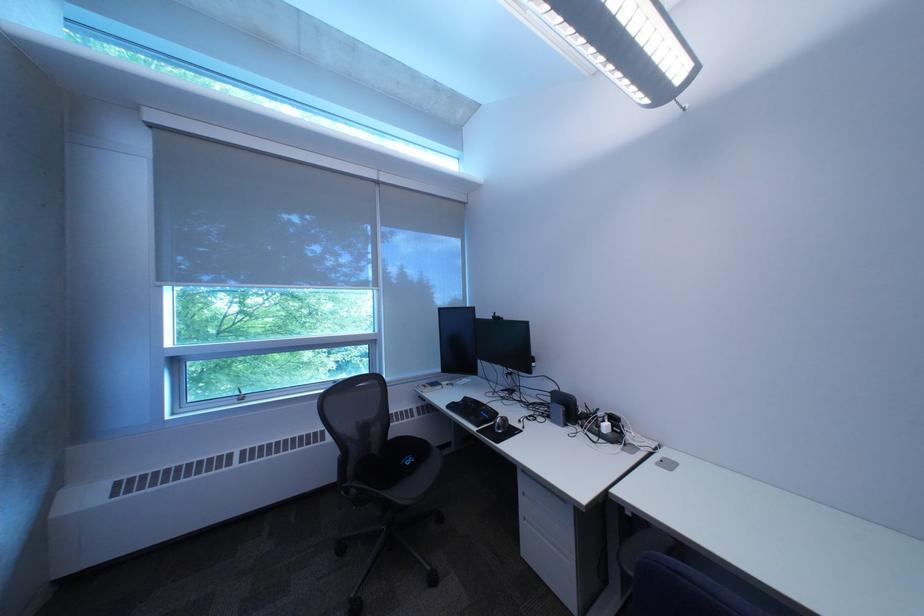
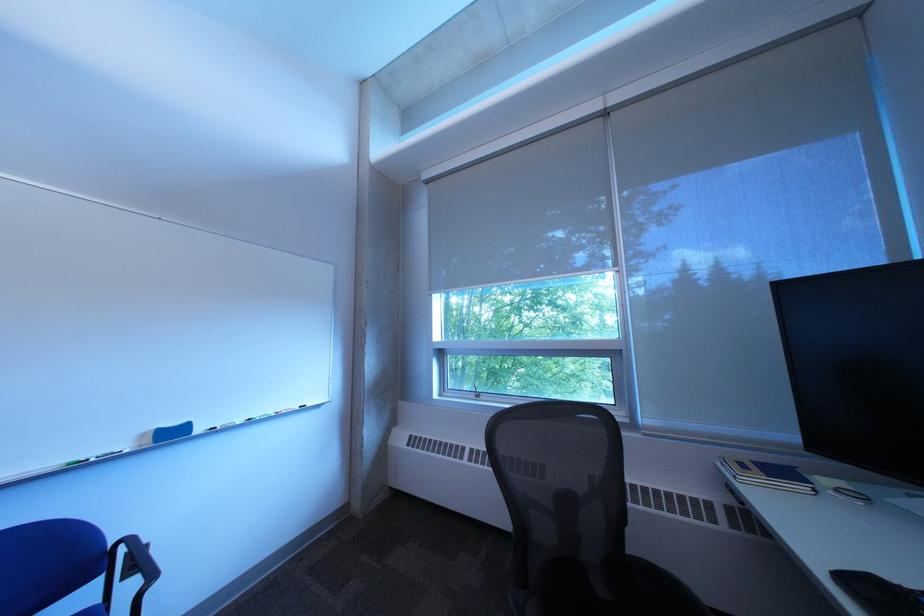
The point at (431, 392) is marked in the first image. Where is the corresponding point in the second image?

(733, 468)